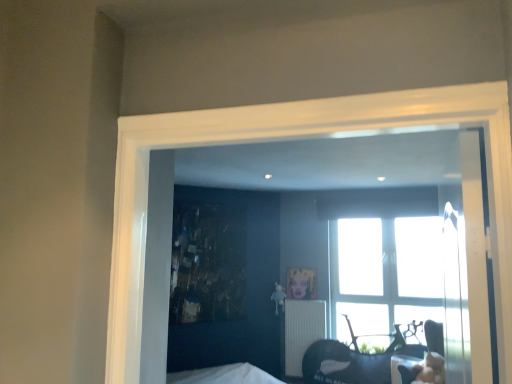
Describe the element at coordinates (302, 331) in the screenshot. I see `white ribbed radiator at center` at that location.

This screenshot has width=512, height=384. In order to click on metallic gold picture frame at center in this screenshot , I will do 301,284.

Measure the distance between metallic gold picture frame at center and camera.

The depth of metallic gold picture frame at center is 5.66 meters.

Where is `transparent glass window at center`? The image size is (512, 384). transparent glass window at center is located at coordinates (392, 251).

Is white ribbed radiator at center positioned far away from metallic gold picture frame at center?

No, white ribbed radiator at center is in close proximity to metallic gold picture frame at center.

Considering the relative sizes of white ribbed radiator at center and metallic gold picture frame at center in the image provided, is white ribbed radiator at center bigger than metallic gold picture frame at center?

Correct, white ribbed radiator at center is larger in size than metallic gold picture frame at center.

Consider the image. Between white ribbed radiator at center and metallic gold picture frame at center, which one has less height?

metallic gold picture frame at center.

Based on the photo, from a real-world perspective, is white ribbed radiator at center physically located above or below metallic gold picture frame at center?

From a real-world perspective, white ribbed radiator at center is physically below metallic gold picture frame at center.

Where is `picture frame above the transparent glass window at center (from a real-world perspective)`? Image resolution: width=512 pixels, height=384 pixels. picture frame above the transparent glass window at center (from a real-world perspective) is located at coordinates (301, 284).

Is metallic gold picture frame at center inside the boundaries of transparent glass window at center, or outside?

metallic gold picture frame at center cannot be found inside transparent glass window at center.

Consider the image. Is metallic gold picture frame at center turned away from transparent glass window at center?

No, transparent glass window at center is not at the back of metallic gold picture frame at center.

Between matte black chair at lower right and transparent glass window at center, which one appears on the right side from the viewer's perspective?

transparent glass window at center is more to the right.

Is matte black chair at lower right located outside transparent glass window at center?

matte black chair at lower right lies outside transparent glass window at center's area.

Is matte black chair at lower right facing towards transparent glass window at center?

No, matte black chair at lower right is not turned towards transparent glass window at center.

Does matte black chair at lower right have a lesser height compared to transparent glass window at center?

Indeed, matte black chair at lower right has a lesser height compared to transparent glass window at center.

Which is in front, point (350, 327) or point (301, 308)?

Point (301, 308)

Is matte black chair at lower right oriented towards white ribbed radiator at center?

No, matte black chair at lower right is not aimed at white ribbed radiator at center.

From a real-world perspective, is matte black chair at lower right positioned above or below white ribbed radiator at center?

From a real-world perspective, matte black chair at lower right is physically below white ribbed radiator at center.

Is the depth of matte black chair at lower right less than that of white ribbed radiator at center?

Yes, it is in front of white ribbed radiator at center.

From a real-world perspective, which object rests below the other?

From a 3D spatial view, white ribbed radiator at center is below.

Is transparent glass window at center bigger or smaller than white ribbed radiator at center?

transparent glass window at center is bigger than white ribbed radiator at center.

From the image's perspective, which one is positioned higher, transparent glass window at center or white ribbed radiator at center?

transparent glass window at center is shown above in the image.

Are transparent glass window at center and white ribbed radiator at center far apart?

That's not correct — transparent glass window at center is a little close to white ribbed radiator at center.

How different are the orientations of transparent glass window at center and matte black chair at lower right in degrees?

The angle between the facing direction of transparent glass window at center and the facing direction of matte black chair at lower right is 4.53 degrees.

Which is further, (358,197) or (351,359)?

The point (358,197) is farther.

Does transparent glass window at center turn towards matte black chair at lower right?

Yes, transparent glass window at center is turned towards matte black chair at lower right.

Between transparent glass window at center and matte black chair at lower right, which one has less height?

matte black chair at lower right.

Between white ribbed radiator at center and transparent glass window at center, which one is positioned behind?

white ribbed radiator at center is further from the camera.

Is white ribbed radiator at center not inside transparent glass window at center?

That's correct, white ribbed radiator at center is outside of transparent glass window at center.

The height and width of the screenshot is (384, 512). In order to click on window above the white ribbed radiator at center (from the image's perspective) in this screenshot , I will do (392, 251).

Is white ribbed radiator at center in contact with transparent glass window at center?

No, white ribbed radiator at center is not touching transparent glass window at center.

At what (x,y) coordinates should I click in order to perform the action: click on picture frame above the white ribbed radiator at center (from the image's perspective). Please return your answer as a coordinate pair (x, y). Image resolution: width=512 pixels, height=384 pixels. Looking at the image, I should click on (301, 284).

You are a GUI agent. You are given a task and a screenshot of the screen. Output one action in this format:
    pyautogui.click(x=<x>, y=<y>)
    Task: Click on the window in front of the metallic gold picture frame at center
    
    Given the screenshot: What is the action you would take?
    pyautogui.click(x=392, y=251)

When comparing their distances from matte black chair at lower right, does transparent glass window at center or metallic gold picture frame at center seem further?

The object further to matte black chair at lower right is metallic gold picture frame at center.

Looking at the image, which one is located further to white ribbed radiator at center, matte black chair at lower right or transparent glass window at center?

Based on the image, transparent glass window at center appears to be further to white ribbed radiator at center.

Considering their positions, is transparent glass window at center positioned further to white ribbed radiator at center than metallic gold picture frame at center?

transparent glass window at center lies further to white ribbed radiator at center than the other object.

From the image, which object appears to be nearer to matte black chair at lower right, transparent glass window at center or white ribbed radiator at center?

Based on the image, white ribbed radiator at center appears to be nearer to matte black chair at lower right.

Based on their spatial positions, is metallic gold picture frame at center or matte black chair at lower right closer to white ribbed radiator at center?

metallic gold picture frame at center.

Based on the photo, which object lies further to the anchor point transparent glass window at center, white ribbed radiator at center or metallic gold picture frame at center?

metallic gold picture frame at center is further to transparent glass window at center.

From the image, which object appears to be nearer to matte black chair at lower right, metallic gold picture frame at center or transparent glass window at center?

transparent glass window at center lies closer to matte black chair at lower right than the other object.

When comparing their distances from matte black chair at lower right, does white ribbed radiator at center or transparent glass window at center seem further?

transparent glass window at center is further to matte black chair at lower right.

Where is `radiator situated between metallic gold picture frame at center and matte black chair at lower right from left to right`? radiator situated between metallic gold picture frame at center and matte black chair at lower right from left to right is located at coordinates (302, 331).

You are a GUI agent. You are given a task and a screenshot of the screen. Output one action in this format:
    pyautogui.click(x=<x>, y=<y>)
    Task: Click on the radiator located between metallic gold picture frame at center and transparent glass window at center in the left-right direction
    This screenshot has height=384, width=512.
    Given the screenshot: What is the action you would take?
    pyautogui.click(x=302, y=331)

Where is `furniture between white ribbed radiator at center and transparent glass window at center from left to right`? furniture between white ribbed radiator at center and transparent glass window at center from left to right is located at coordinates (354, 361).

You are a GUI agent. You are given a task and a screenshot of the screen. Output one action in this format:
    pyautogui.click(x=<x>, y=<y>)
    Task: Click on the furniture situated between metallic gold picture frame at center and transparent glass window at center from left to right
    The height and width of the screenshot is (384, 512).
    Given the screenshot: What is the action you would take?
    pyautogui.click(x=354, y=361)